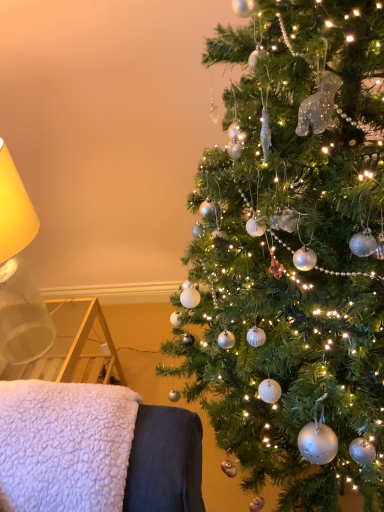
Question: Does white fluffy blanket at lower left appear on the right side of translucent glass lampshade at left?

Choices:
 (A) yes
 (B) no

Answer: (A)

Question: From the image's perspective, is white fluffy blanket at lower left on translucent glass lampshade at left?

Choices:
 (A) yes
 (B) no

Answer: (B)

Question: Is white fluffy blanket at lower left next to translucent glass lampshade at left?

Choices:
 (A) no
 (B) yes

Answer: (A)

Question: Is white fluffy blanket at lower left aimed at translucent glass lampshade at left?

Choices:
 (A) yes
 (B) no

Answer: (B)

Question: Is white fluffy blanket at lower left not inside translucent glass lampshade at left?

Choices:
 (A) yes
 (B) no

Answer: (A)

Question: Is translucent glass lampshade at left at the back of white fluffy blanket at lower left?

Choices:
 (A) no
 (B) yes

Answer: (A)

Question: Does shiny silver ornaments at right appear on the left side of white fluffy blanket at lower left?

Choices:
 (A) yes
 (B) no

Answer: (B)

Question: Does shiny silver ornaments at right have a smaller size compared to white fluffy blanket at lower left?

Choices:
 (A) no
 (B) yes

Answer: (A)

Question: Considering the relative sizes of shiny silver ornaments at right and white fluffy blanket at lower left in the image provided, is shiny silver ornaments at right taller than white fluffy blanket at lower left?

Choices:
 (A) yes
 (B) no

Answer: (A)

Question: Can you confirm if shiny silver ornaments at right is shorter than white fluffy blanket at lower left?

Choices:
 (A) no
 (B) yes

Answer: (A)

Question: From a real-world perspective, does shiny silver ornaments at right stand above white fluffy blanket at lower left?

Choices:
 (A) no
 (B) yes

Answer: (B)

Question: Is white fluffy blanket at lower left inside shiny silver ornaments at right?

Choices:
 (A) yes
 (B) no

Answer: (B)

Question: Is translucent glass lampshade at left turned away from shiny silver ornaments at right?

Choices:
 (A) yes
 (B) no

Answer: (B)